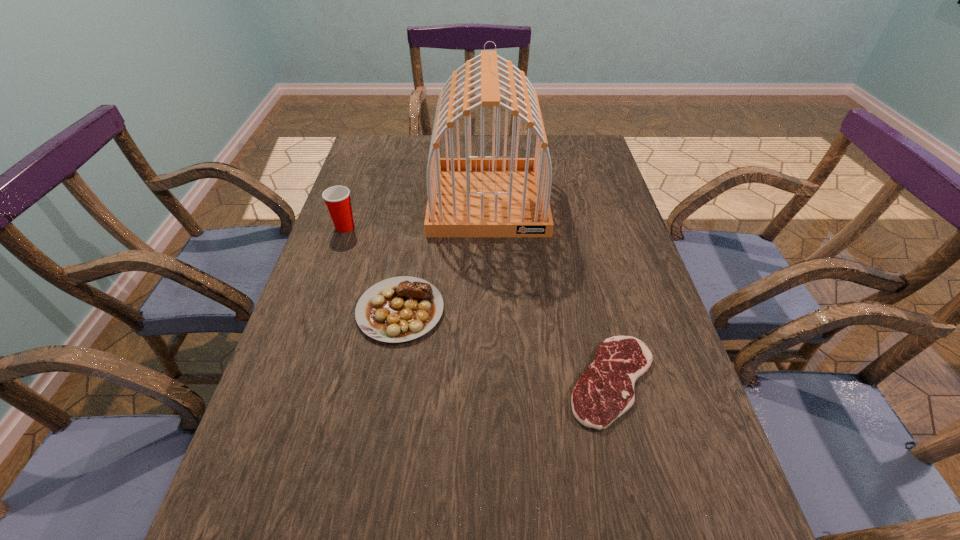
Image resolution: width=960 pixels, height=540 pixels. I want to click on free space between the leftmost object and the birdcage, so click(x=417, y=214).

Identify the location of vacant area between the left steak and the shortest object. (507, 346).

This screenshot has height=540, width=960. I want to click on vacant region between the birdcage and the leftmost object, so click(417, 214).

Identify the location of blank region between the birdcage and the leftmost object. (417, 214).

Identify the location of free space between the shortest object and the Dixie cup. (479, 304).

Locate an element on the screen. vacant space that is in between the third shortest object and the left steak is located at coordinates (372, 268).

Image resolution: width=960 pixels, height=540 pixels. Find the location of `free point between the shortest object and the birdcage`. free point between the shortest object and the birdcage is located at coordinates (550, 291).

Find the location of a particular element. This screenshot has width=960, height=540. vacant area that lies between the second shortest object and the birdcage is located at coordinates click(444, 255).

Find the location of `unoccupied position between the second shortest object and the tallest object`. unoccupied position between the second shortest object and the tallest object is located at coordinates (444, 255).

The height and width of the screenshot is (540, 960). In order to click on vacant region between the second tallest object and the taller steak in this screenshot , I will do `click(372, 268)`.